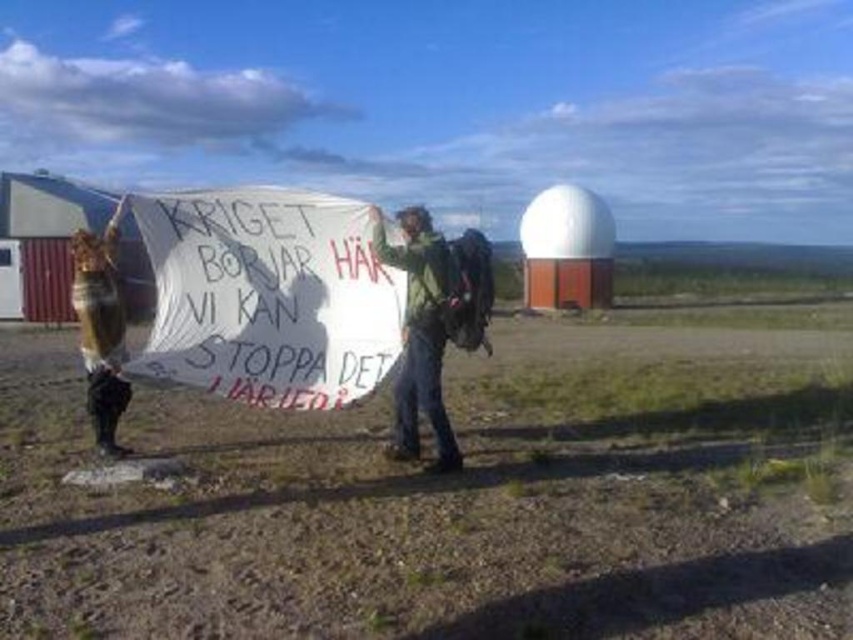
Can you confirm if white paper sign at center is positioned above green fabric at center?

Yes.

Between white paper sign at center and green fabric at center, which one is positioned higher?

white paper sign at center is above.

This screenshot has height=640, width=853. Find the location of `white paper sign at center`. white paper sign at center is located at coordinates (267, 296).

Which is above, white paper sign at center or wooden sign at left?

wooden sign at left is higher up.

Is point (350, 257) closer to viewer compared to point (83, 342)?

No, (350, 257) is further to viewer.

Find the location of a particular element. white paper sign at center is located at coordinates (267, 296).

Is brown dirt field at center thinner than green fabric at center?

In fact, brown dirt field at center might be wider than green fabric at center.

Does brown dirt field at center appear on the right side of green fabric at center?

Yes, brown dirt field at center is to the right of green fabric at center.

Which is in front, point (144, 545) or point (419, 368)?

Point (144, 545)

Locate an element on the screen. This screenshot has height=640, width=853. brown dirt field at center is located at coordinates (451, 499).